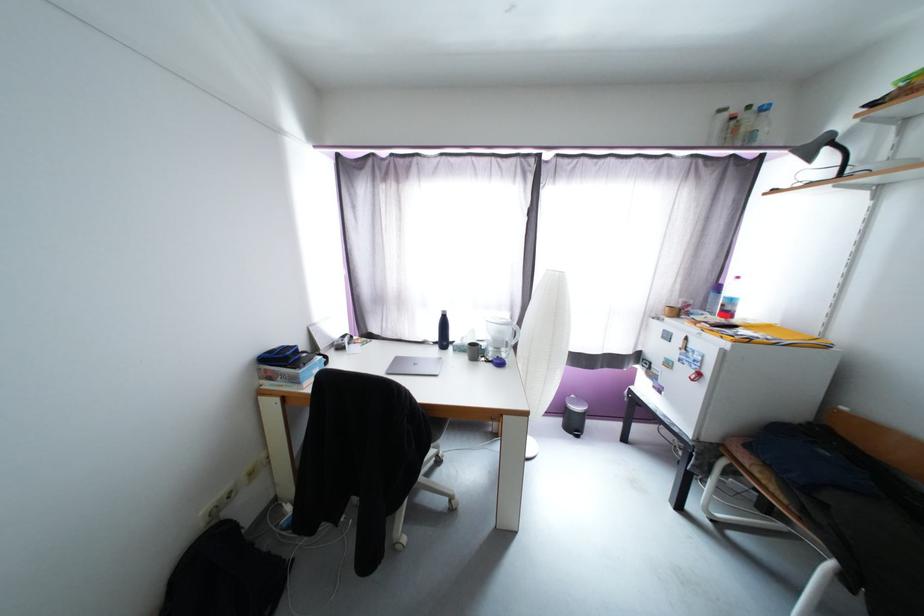
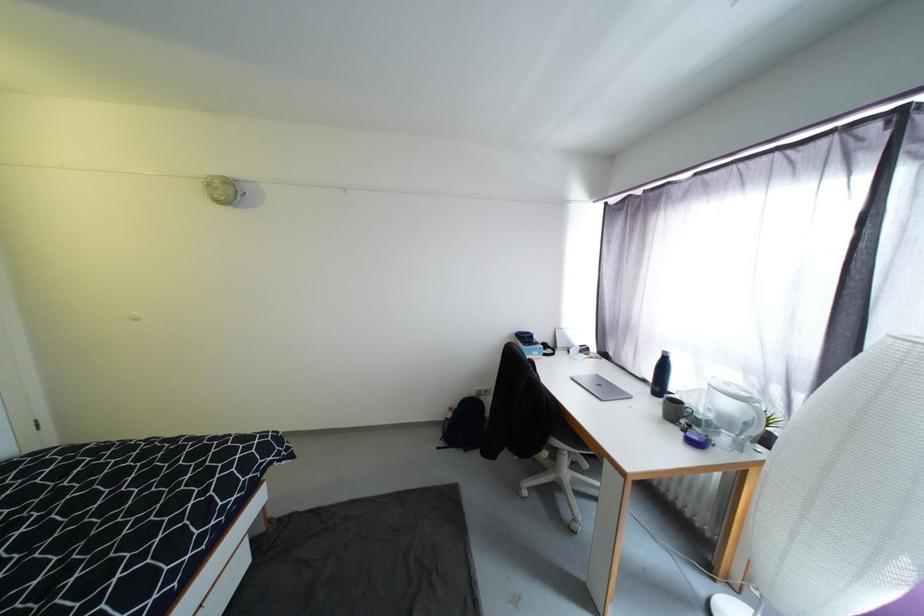
Question: Based on the continuous images, in which direction is the camera rotating? Reply with the corresponding letter.

Choices:
 (A) Left
 (B) Right
 (C) Up
 (D) Down

Answer: (A)